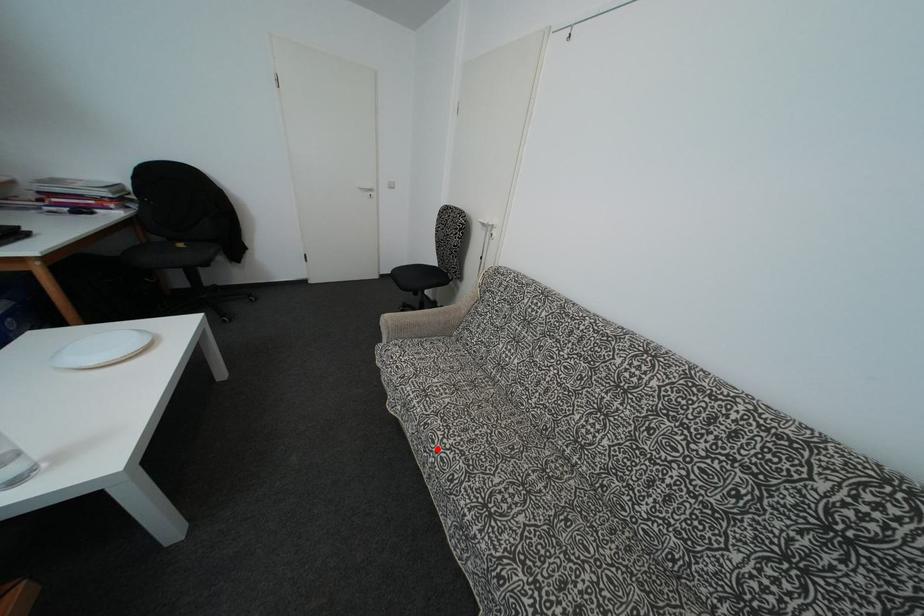
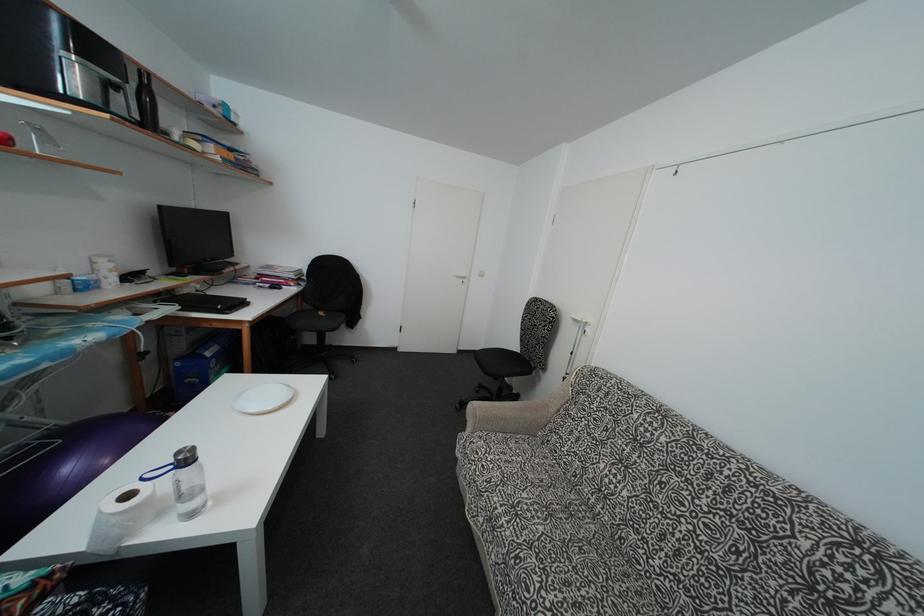
Where in the second image is the point corresponding to the highlighted location from the first image?

(532, 598)